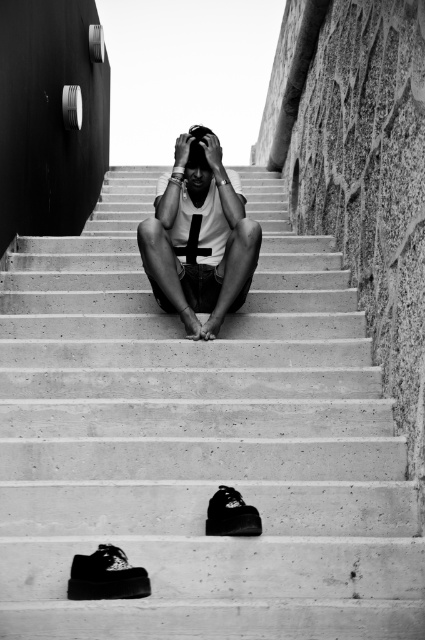
You are a photographer trying to capture the black leather shoe at lower center and the concrete stairs at center in a single frame. Based on their positions, which object should you focus on first to ensure both are in the frame?

The black leather shoe at lower center should be focused on first since it is positioned below the concrete stairs at center, allowing the photographer to frame the shot starting from the lower part and include both objects in the composition.

You are an architect analyzing the layout of this stairway. You need to place a small decorative plant exactly at the midpoint between the black leather shoe at center and the top of the stairs. What coordinates should you use for the plant?

The midpoint between the black leather shoe at center at coordinates (231, 515) and the top of the stairs would be at coordinates (328, 515).